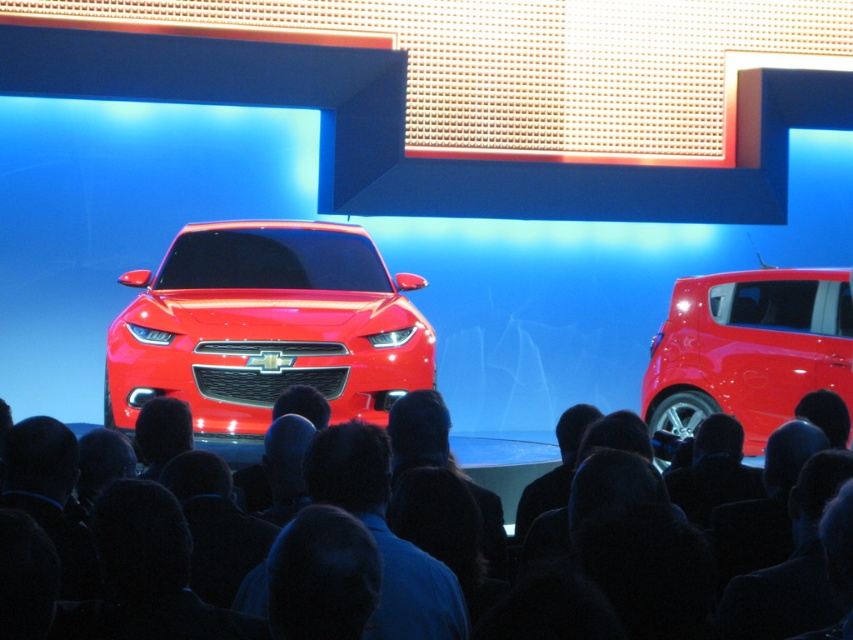
You are an attendee at the car show and want to take a photo of the glossy metallic car at center without anyone blocking your view. Which side of the car should you move to in order to avoid the black hair at center?

The black hair at center is positioned on the right side of the glossy metallic car at center. To avoid the black hair at center blocking your view, you should move to the left side of the glossy metallic car at center.